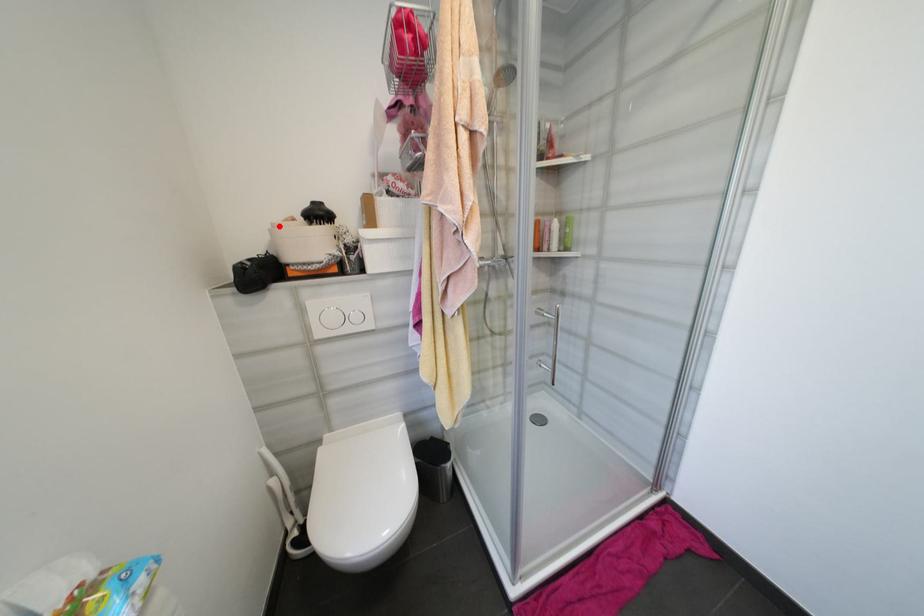
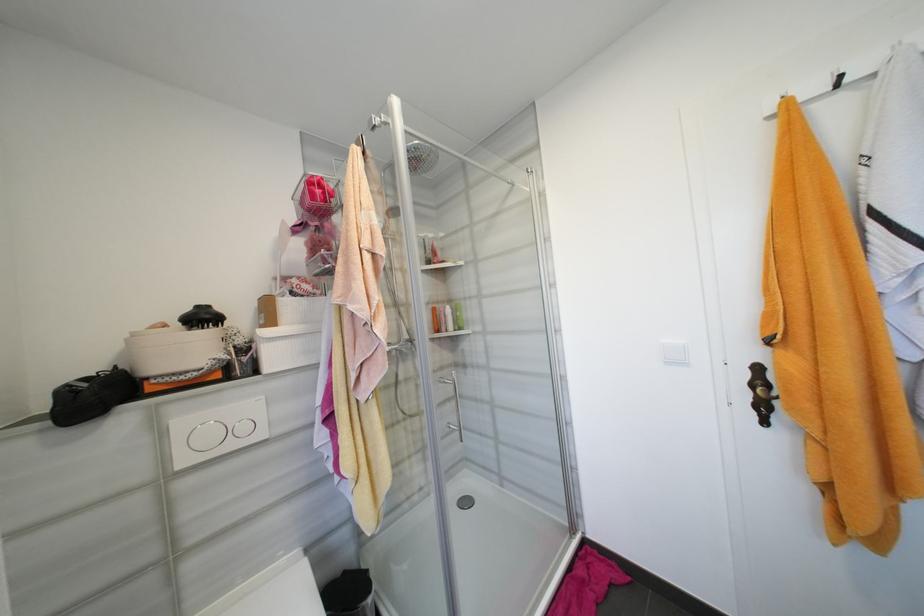
Locate, in the second image, the point that corresponds to the highlighted location in the first image.

(140, 334)